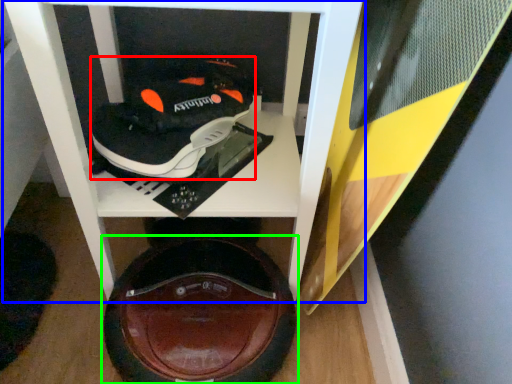
Question: Based on their relative distances, which object is nearer to shoe (highlighted by a red box)? Choose from furniture (highlighted by a blue box) and footwear (highlighted by a green box).

Choices:
 (A) furniture
 (B) footwear

Answer: (A)